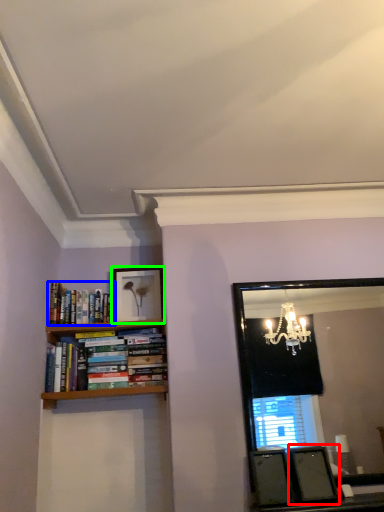
Question: Based on their relative distances, which object is nearer to picture frame (highlighted by a red box)? Choose from book (highlighted by a blue box) and picture frame (highlighted by a green box).

Choices:
 (A) book
 (B) picture frame

Answer: (B)